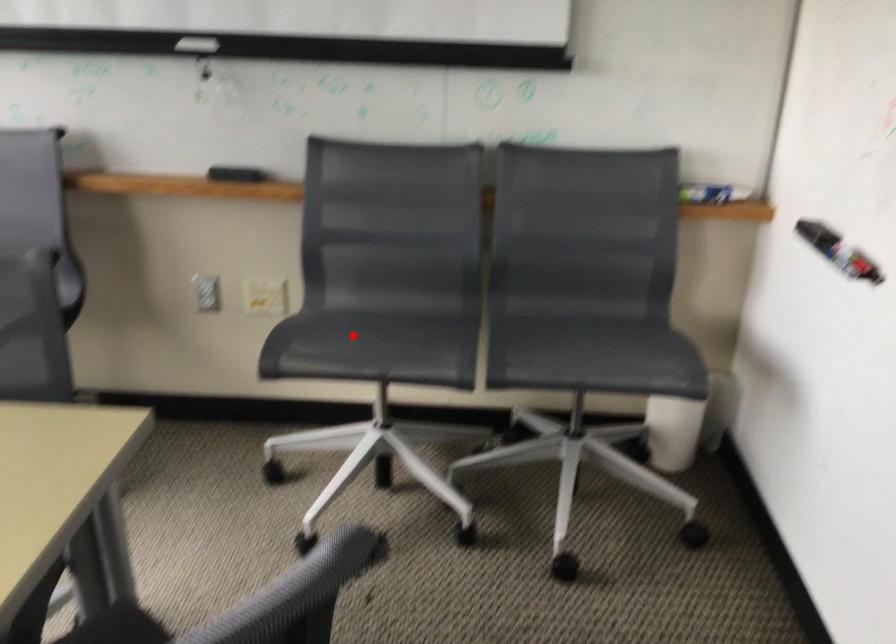
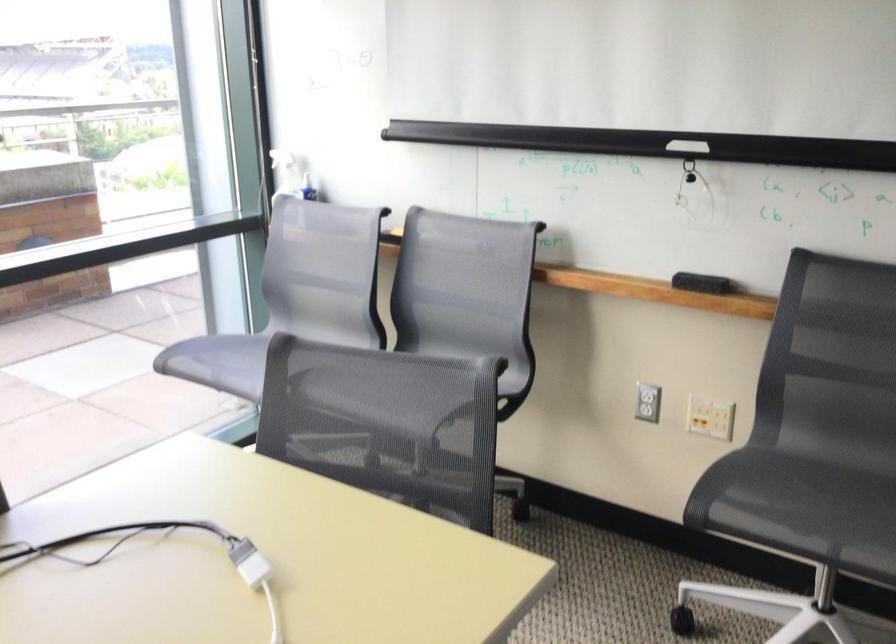
Locate, in the second image, the point that corresponds to the highlighted location in the first image.

(782, 494)